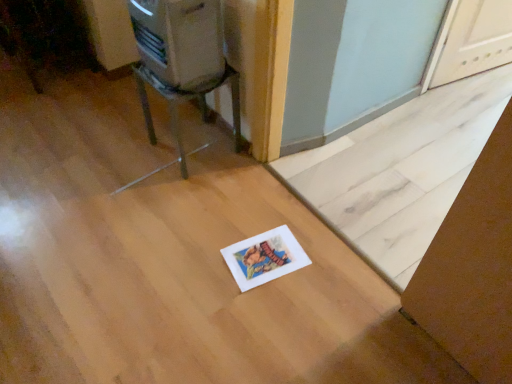
The height and width of the screenshot is (384, 512). I want to click on white paper at lower center, so click(401, 170).

Image resolution: width=512 pixels, height=384 pixels. Find the location of `metallic silver appliance at upper left`. metallic silver appliance at upper left is located at coordinates (180, 41).

Is metallic silver appliance at upper left far from metallic silver chair at upper left?

That's not correct — metallic silver appliance at upper left is a little close to metallic silver chair at upper left.

Which is behind, metallic silver appliance at upper left or metallic silver chair at upper left?

metallic silver chair at upper left is behind.

From a real-world perspective, between metallic silver appliance at upper left and metallic silver chair at upper left, who is vertically higher?

metallic silver appliance at upper left, from a real-world perspective.

Considering the relative positions of metallic silver appliance at upper left and metallic silver chair at upper left in the image provided, is metallic silver appliance at upper left to the right of metallic silver chair at upper left from the viewer's perspective?

No.

From the picture: From the image's perspective, relative to metallic silver appliance at upper left, is white paper at lower center above or below?

white paper at lower center is below metallic silver appliance at upper left.

Does white paper at lower center have a lesser width compared to metallic silver appliance at upper left?

No, white paper at lower center is not thinner than metallic silver appliance at upper left.

Can you confirm if white paper at lower center is taller than metallic silver appliance at upper left?

In fact, white paper at lower center may be shorter than metallic silver appliance at upper left.

In the scene shown: From a real-world perspective, which is physically below, white paper at lower center or metallic silver appliance at upper left?

white paper at lower center.

Which is behind, point (358, 208) or point (165, 89)?

Point (358, 208)

Is white paper at lower center positioned before metallic silver chair at upper left?

Yes, white paper at lower center is closer to the viewer.

I want to click on furniture above the white paper at lower center (from a real-world perspective), so (x=186, y=99).

Is white paper at lower center positioned with its back to metallic silver chair at upper left?

No, metallic silver chair at upper left is not at the back of white paper at lower center.

From the image's perspective, is metallic silver appliance at upper left located above or below white paper at lower center?

From the image's perspective, metallic silver appliance at upper left appears above white paper at lower center.

Considering the relative sizes of metallic silver appliance at upper left and white paper at lower center in the image provided, is metallic silver appliance at upper left wider than white paper at lower center?

No, metallic silver appliance at upper left is not wider than white paper at lower center.

Is metallic silver appliance at upper left at the right side of white paper at lower center?

No.

Between metallic silver appliance at upper left and white paper at lower center, which one is positioned behind?

white paper at lower center.

Is metallic silver chair at upper left turned away from white paper at lower center?

No, metallic silver chair at upper left's orientation is not away from white paper at lower center.

Can you confirm if metallic silver chair at upper left is smaller than white paper at lower center?

Correct, metallic silver chair at upper left occupies less space than white paper at lower center.

Does point (230, 84) appear closer or farther from the camera than point (277, 163)?

Point (230, 84) appears to be closer to the viewer than point (277, 163).

Where is `furniture on the left of the white paper at lower center`? furniture on the left of the white paper at lower center is located at coordinates (186, 99).

Is metallic silver chair at upper left positioned in front of metallic silver appliance at upper left?

No, metallic silver chair at upper left is further to the viewer.

Considering the relative sizes of metallic silver chair at upper left and metallic silver appliance at upper left in the image provided, is metallic silver chair at upper left smaller than metallic silver appliance at upper left?

Incorrect, metallic silver chair at upper left is not smaller in size than metallic silver appliance at upper left.

Which point is more distant from viewer, (x=144, y=65) or (x=165, y=21)?

The point (x=144, y=65) is farther from the camera.

From the image's perspective, is metallic silver chair at upper left beneath metallic silver appliance at upper left?

Yes.

The width and height of the screenshot is (512, 384). What are the coordinates of `furniture to the right of metallic silver appliance at upper left` in the screenshot? It's located at (186, 99).

You are a GUI agent. You are given a task and a screenshot of the screen. Output one action in this format:
    pyautogui.click(x=<x>, y=<y>)
    Task: Click on the doormat lying behind the metallic silver appliance at upper left
    This screenshot has height=384, width=512.
    Given the screenshot: What is the action you would take?
    click(x=401, y=170)

Estimate the real-world distances between objects in this image. Which object is further from white paper at lower center, metallic silver appliance at upper left or metallic silver chair at upper left?

metallic silver appliance at upper left.

When comparing their distances from metallic silver chair at upper left, does metallic silver appliance at upper left or white paper at lower center seem further?

white paper at lower center.

Looking at this image, based on their spatial positions, is metallic silver chair at upper left or metallic silver appliance at upper left closer to white paper at lower center?

metallic silver chair at upper left is closer to white paper at lower center.

Looking at the image, which one is located further to metallic silver appliance at upper left, white paper at lower center or metallic silver chair at upper left?

Based on the image, white paper at lower center appears to be further to metallic silver appliance at upper left.

Based on their spatial positions, is white paper at lower center or metallic silver appliance at upper left further from metallic silver chair at upper left?

white paper at lower center lies further to metallic silver chair at upper left than the other object.

In the scene shown: Estimate the real-world distances between objects in this image. Which object is closer to metallic silver appliance at upper left, metallic silver chair at upper left or white paper at lower center?

metallic silver chair at upper left lies closer to metallic silver appliance at upper left than the other object.

Locate an element on the screen. This screenshot has height=384, width=512. furniture between metallic silver appliance at upper left and white paper at lower center is located at coordinates (186, 99).